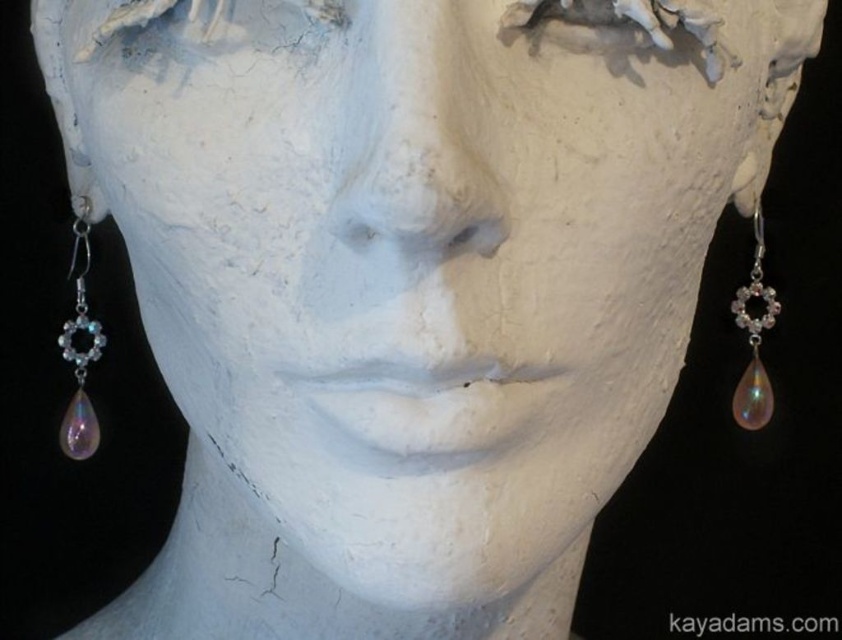
From the picture: You are an art conservator working on a sculpture. The sculpture has two iridescent glass teardrops attached as earrings. You need to ensure that the distance between them is safe for preservation. The recommended minimum distance between such delicate items is 50 centimeters. Based on the image, is the current distance between the iridescent glass teardrop at left and the iridescent glass teardrop at right sufficient?

The iridescent glass teardrop at left is 52.49 centimeters away from the iridescent glass teardrop at right. Since the recommended minimum distance is 50 centimeters, the current distance is sufficient for preservation.

You are an art conservator examining the bust and its earrings. You need to determine if the iridescent glass teardrop at left and the iridescent glass teardrop at right are symmetrical in size. Based on the image, what can you conclude?

The iridescent glass teardrop at left is larger than the iridescent glass teardrop at right, so they are not symmetrical in size.